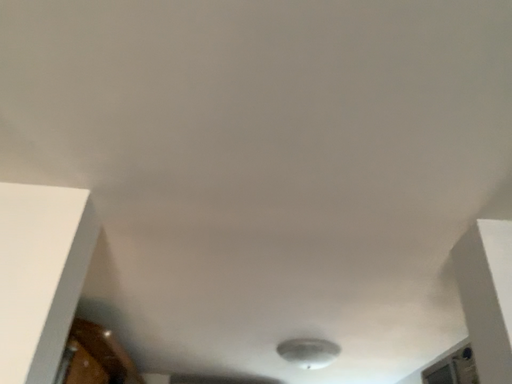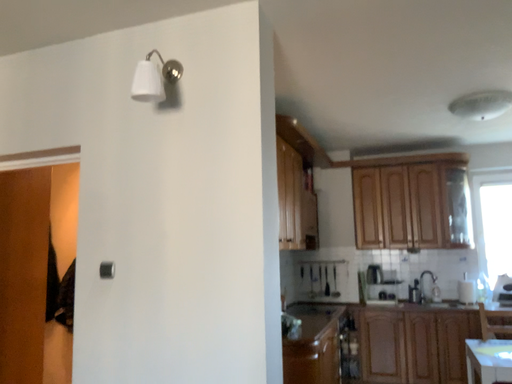
Question: Which way did the camera rotate in the video?

Choices:
 (A) rotated downward
 (B) rotated upward

Answer: (A)